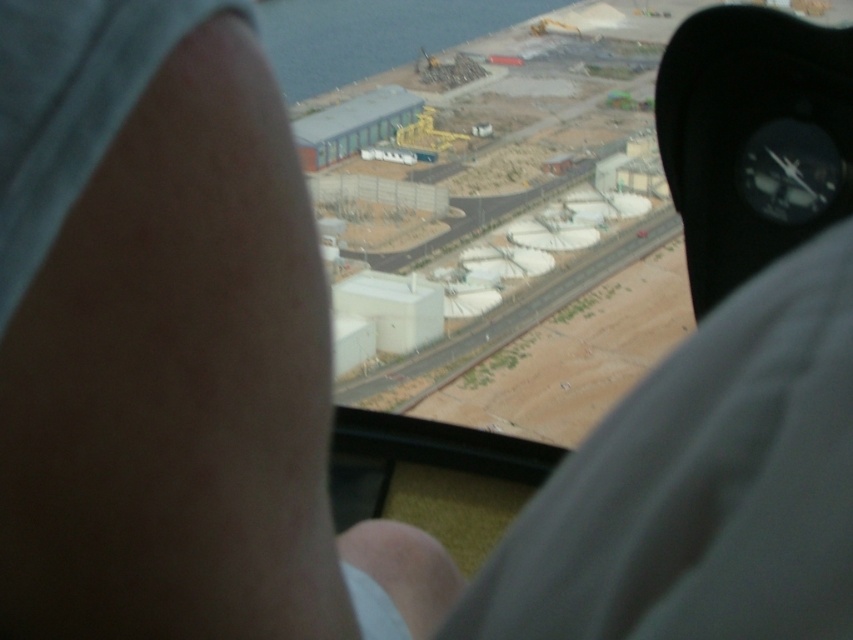
You are a passenger in the helicopter and want to point out the blue water at upper left and the white concrete train track at center to the pilot. Which one is higher from the ground?

The blue water at upper left is higher from the ground than the white concrete train track at center because it is positioned above it in the image.

You are a pilot flying over a region and need to identify landmarks. Looking out the window, you see the blue water at upper left and the white concrete train track at center. Which of these landmarks is bigger in the image?

The blue water at upper left is larger in size than the white concrete train track at center, so the blue water at upper left is bigger in the image.